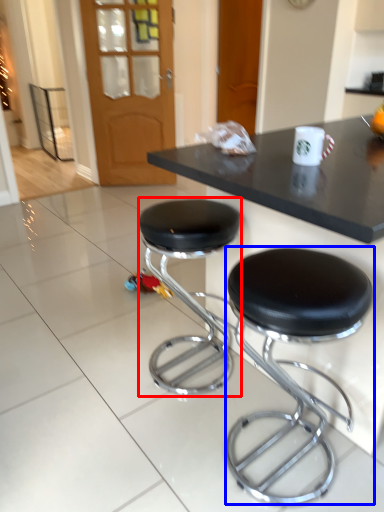
Question: Which of the following is the farthest to the observer, stool (highlighted by a red box) or stool (highlighted by a blue box)?

Choices:
 (A) stool
 (B) stool

Answer: (A)